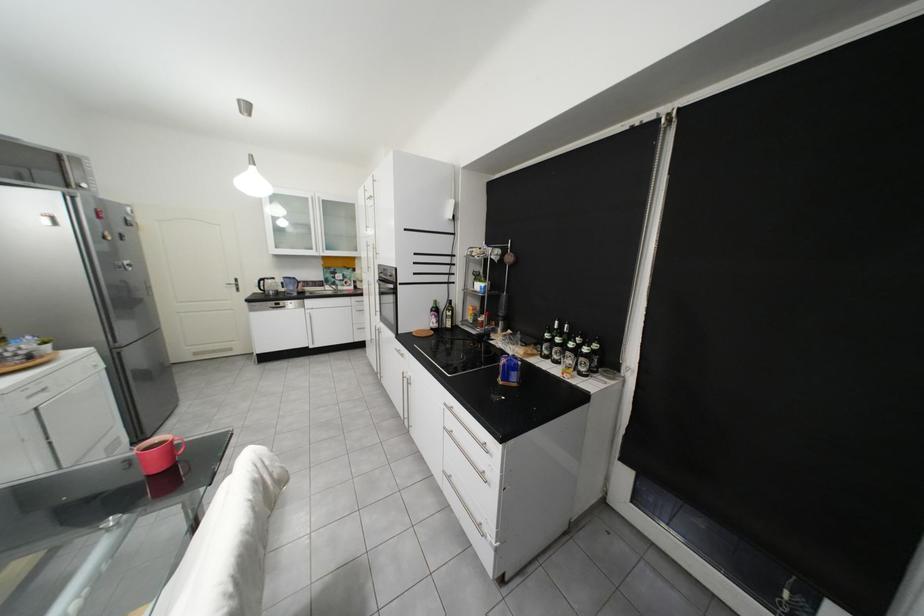
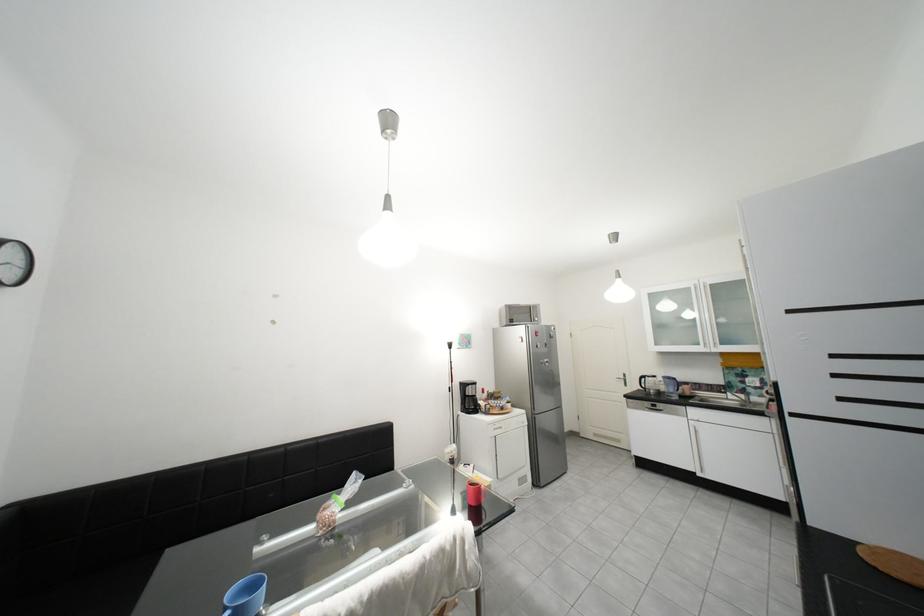
Question: How did the camera likely rotate?

Choices:
 (A) Left
 (B) Right
 (C) Up
 (D) Down

Answer: (A)